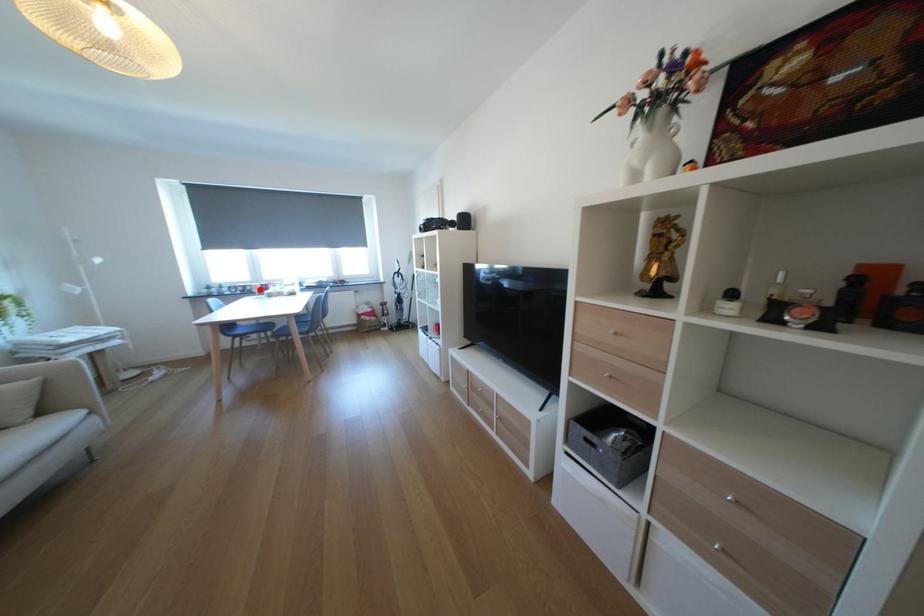
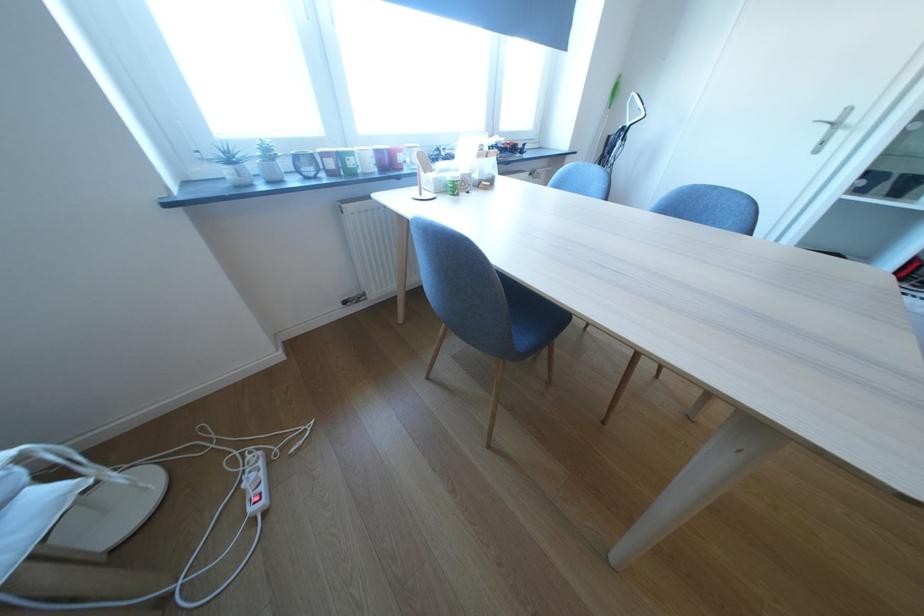
Find the pixel in the second image that matches the highlighted location in the first image.

(361, 164)